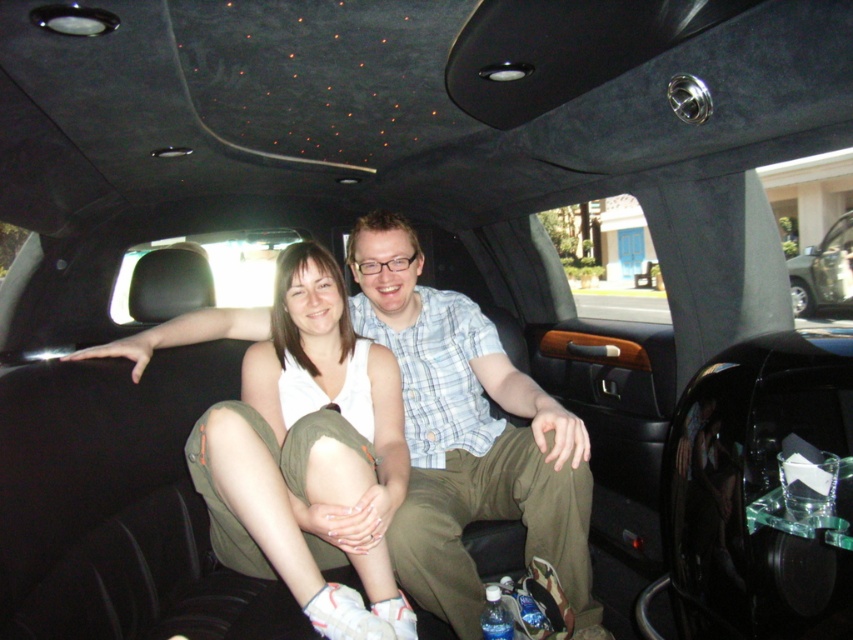
You are standing in front of the limousine and want to reach the point at coordinates point (415,388) inside the vehicle. If your arm can extend 6 feet, can you reach that point?

The distance between you and point (415,388) is 7.99 feet, which is longer than your arm extension of 6 feet. Therefore, you cannot reach the point.

In the scene shown: You are a photographer inside the limousine and want to take a photo of the light blue plaid shirt at center and the metallic silver car at center. Which object will appear narrower in the photo?

The light blue plaid shirt at center will appear narrower in the photo because it is thinner than the metallic silver car at center.